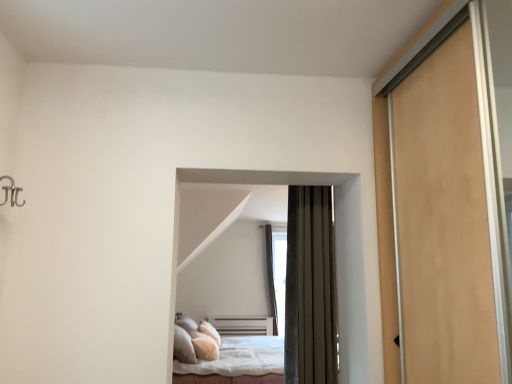
Question: From the image's perspective, is dark brown fabric bed at center, the 1th bed viewed from the top, above or below transparent glass window at center?

Choices:
 (A) below
 (B) above

Answer: (B)

Question: Is point click(x=187, y=173) closer or farther from the camera than point click(x=270, y=268)?

Choices:
 (A) closer
 (B) farther

Answer: (A)

Question: Estimate the real-world distances between objects in this image. Which object is closer to the dark brown fabric bed at center, which ranks as the 2th bed in back-to-front order?

Choices:
 (A) transparent glass window at center
 (B) white soft bed at center, positioned as the 1th bed in back-to-front order

Answer: (B)

Question: Based on their relative distances, which object is nearer to the dark brown fabric bed at center, which is the 2th bed from bottom to top?

Choices:
 (A) transparent glass window at center
 (B) white soft bed at center, marked as the first bed in a bottom-to-top arrangement

Answer: (B)